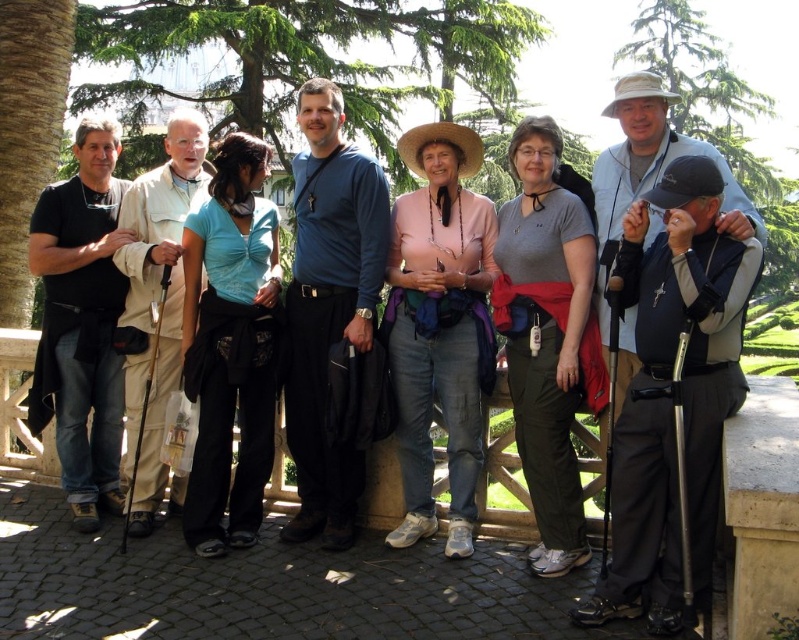
You are part of a photography team trying to capture the group in the image. The photographer wants to ensure that the gray fabric shirt at center and the blue matte shirt at center are both visible in the frame. Based on their positions, which shirt should you focus on first to ensure both are in the shot?

The gray fabric shirt at center is to the right of the blue matte shirt at center, so focusing on the blue matte shirt at center first would allow the photographer to frame the shot to include both shirts since the gray one is positioned to its right.

You are organizing a group photo and need to ensure everyone fits within the frame. The camera you are using has a limited field of view. Given the current arrangement, does the gray fabric shirt at center take up more or less space in the photo compared to the black matte jacket at left?

The gray fabric shirt at center occupies less space than the black matte jacket at left, so it takes up less space in the photo.

You are standing at the blue fabric shirt at center and want to reach a friend who is 28 meters away. The paved walkway is 3 meters wide. Can you walk straight ahead without stepping off the walkway?

Yes, you can walk straight ahead because the paved walkway is 3 meters wide, which is sufficient for a person to walk 28 meters without needing to step off the walkway.